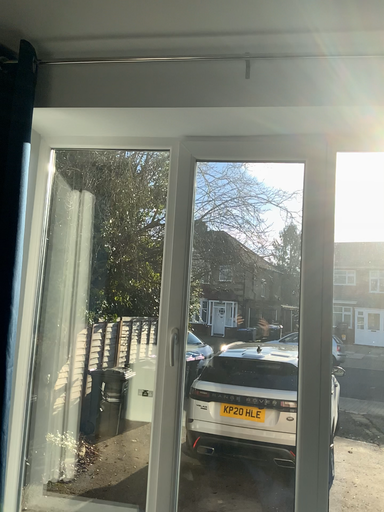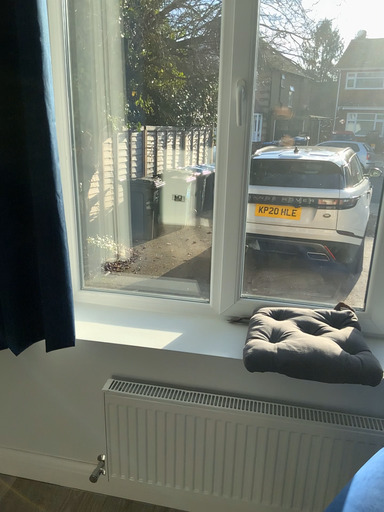
Question: How did the camera likely rotate when shooting the video?

Choices:
 (A) rotated upward
 (B) rotated downward

Answer: (B)